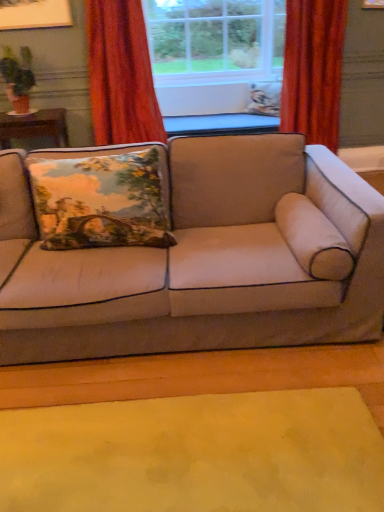
What is the approximate width of floral fabric pillow at center, which appears as the 2th pillow when viewed from the left?

It is 8.30 inches.

Image resolution: width=384 pixels, height=512 pixels. What do you see at coordinates (264, 98) in the screenshot?
I see `floral fabric pillow at center, marked as the 1th pillow in a right-to-left arrangement` at bounding box center [264, 98].

The height and width of the screenshot is (512, 384). Describe the element at coordinates (196, 454) in the screenshot. I see `yellow felt mat at lower center` at that location.

Consider the image. What is the approximate width of clear glass window at center?

32.29 inches.

The height and width of the screenshot is (512, 384). What do you see at coordinates (121, 74) in the screenshot?
I see `velvet orange curtain at upper left, the 1th curtain viewed from the left` at bounding box center [121, 74].

Measure the distance between point (331, 104) and camera.

Point (331, 104) is 3.58 meters away from camera.

I want to click on beige fabric couch at center, so click(204, 260).

Describe the element at coordinates (204, 260) in the screenshot. This screenshot has width=384, height=512. I see `beige fabric couch at center` at that location.

Find the location of `floral fabric pillow at center, which appears as the 1th pillow when viewed from the top`. floral fabric pillow at center, which appears as the 1th pillow when viewed from the top is located at coordinates (264, 98).

Considering the positions of objects velvet orange curtain at upper left, the second curtain when ordered from right to left, and clear glass window at center in the image provided, who is more to the left, velvet orange curtain at upper left, the second curtain when ordered from right to left, or clear glass window at center?

velvet orange curtain at upper left, the second curtain when ordered from right to left.

Considering the positions of points (140, 91) and (250, 60), is point (140, 91) farther from camera compared to point (250, 60)?

No, (140, 91) is closer to viewer.

Is the surface of velvet orange curtain at upper left, the second curtain when ordered from right to left, in direct contact with clear glass window at center?

No, velvet orange curtain at upper left, the second curtain when ordered from right to left, is not making contact with clear glass window at center.

Considering the positions of point (31, 57) and point (262, 224), is point (31, 57) closer or farther from the camera than point (262, 224)?

Point (31, 57) is farther from the camera than point (262, 224).

How different are the orientations of matte brown pot at left and beige fabric couch at center in degrees?

matte brown pot at left and beige fabric couch at center are facing 1.25 degrees away from each other.

Is matte brown pot at left oriented towards beige fabric couch at center?

No.

Looking at this image, from the image's perspective, relative to beige fabric couch at center, is matte brown pot at left above or below?

matte brown pot at left is situated higher than beige fabric couch at center in the image.

Is velvet-like red curtain at right, acting as the first curtain starting from the right, oriented towards beige fabric couch at center?

No, velvet-like red curtain at right, acting as the first curtain starting from the right, does not turn towards beige fabric couch at center.

Based on their sizes in the image, would you say velvet-like red curtain at right, acting as the first curtain starting from the right, is bigger or smaller than beige fabric couch at center?

In the image, velvet-like red curtain at right, acting as the first curtain starting from the right, appears to be smaller than beige fabric couch at center.

Are velvet-like red curtain at right, positioned as the second curtain in left-to-right order, and beige fabric couch at center beside each other?

There is a gap between velvet-like red curtain at right, positioned as the second curtain in left-to-right order, and beige fabric couch at center.

From a real-world perspective, does velvet orange curtain at upper left, the second curtain when ordered from right to left, sit lower than matte brown pot at left?

Yes, from a real-world perspective, velvet orange curtain at upper left, the second curtain when ordered from right to left, is beneath matte brown pot at left.

Is velvet orange curtain at upper left, the second curtain when ordered from right to left, far from matte brown pot at left?

velvet orange curtain at upper left, the second curtain when ordered from right to left, is near matte brown pot at left, not far away.

Is velvet orange curtain at upper left, the second curtain when ordered from right to left, bigger than matte brown pot at left?

Yes, velvet orange curtain at upper left, the second curtain when ordered from right to left, is bigger than matte brown pot at left.

Between point (137, 22) and point (19, 92), which one is positioned behind?

Point (19, 92)

Based on the photo, measure the distance from yellow felt mat at lower center to matte brown pot at left.

They are 2.87 meters apart.

Which of these two, yellow felt mat at lower center or matte brown pot at left, stands shorter?

Standing shorter between the two is yellow felt mat at lower center.

From the image's perspective, is yellow felt mat at lower center beneath matte brown pot at left?

Yes, from the image's perspective, yellow felt mat at lower center is below matte brown pot at left.

Is yellow felt mat at lower center to the right of matte brown pot at left from the viewer's perspective?

Indeed, yellow felt mat at lower center is positioned on the right side of matte brown pot at left.

From the picture: Measure the distance between yellow felt mat at lower center and clear glass window at center.

The distance of yellow felt mat at lower center from clear glass window at center is 14.08 feet.

Is yellow felt mat at lower center shorter than clear glass window at center?

Yes.

Considering the positions of objects yellow felt mat at lower center and clear glass window at center in the image provided, who is more to the right, yellow felt mat at lower center or clear glass window at center?

Positioned to the right is clear glass window at center.

From a real-world perspective, does floral fabric pillow at center, which is counted as the second pillow, starting from the front, sit lower than velvet-like red curtain at right, positioned as the second curtain in left-to-right order?

Yes, from a real-world perspective, floral fabric pillow at center, which is counted as the second pillow, starting from the front, is below velvet-like red curtain at right, positioned as the second curtain in left-to-right order.

From the image's perspective, is floral fabric pillow at center, which appears as the 1th pillow when viewed from the top, located above or below velvet-like red curtain at right, positioned as the second curtain in left-to-right order?

floral fabric pillow at center, which appears as the 1th pillow when viewed from the top, is above velvet-like red curtain at right, positioned as the second curtain in left-to-right order.

Considering the positions of point (250, 98) and point (296, 34), is point (250, 98) closer or farther from the camera than point (296, 34)?

Point (250, 98).

Identify the location of pillow that appears above the velvet-like red curtain at right, positioned as the second curtain in left-to-right order (from the image's perspective). (264, 98).

This screenshot has height=512, width=384. Identify the location of the 1st curtain positioned below the clear glass window at center (from a real-world perspective). (121, 74).

Identify the location of studio couch on the right of matte brown pot at left. (204, 260).

When comparing their distances from velvet floral pillow at left, the 2th pillow from the back, does clear glass window at center or velvet orange curtain at upper left, the 1th curtain viewed from the left, seem further?

Based on the image, clear glass window at center appears to be further to velvet floral pillow at left, the 2th pillow from the back.

Considering their positions, is velvet floral pillow at left, which is the first pillow in bottom-to-top order, positioned further to velvet orange curtain at upper left, the 1th curtain viewed from the left, than beige fabric couch at center?

beige fabric couch at center lies further to velvet orange curtain at upper left, the 1th curtain viewed from the left, than the other object.

When comparing their distances from matte brown pot at left, does beige fabric couch at center or floral fabric pillow at center, placed as the 2th pillow when sorted from bottom to top, seem further?

The object further to matte brown pot at left is beige fabric couch at center.

Which object lies nearer to the anchor point floral fabric pillow at center, which is counted as the second pillow, starting from the front, beige fabric couch at center or velvet-like red curtain at right, acting as the first curtain starting from the right?

Among the two, velvet-like red curtain at right, acting as the first curtain starting from the right, is located nearer to floral fabric pillow at center, which is counted as the second pillow, starting from the front.

In the scene shown: Looking at the image, which one is located closer to matte brown pot at left, beige fabric couch at center or velvet orange curtain at upper left, the second curtain when ordered from right to left?

Based on the image, velvet orange curtain at upper left, the second curtain when ordered from right to left, appears to be nearer to matte brown pot at left.

Based on their spatial positions, is clear glass window at center or floral fabric pillow at center, marked as the 1th pillow in a right-to-left arrangement, further from yellow felt mat at lower center?

clear glass window at center.

From the picture: Which object lies further to the anchor point beige fabric couch at center, clear glass window at center or floral fabric pillow at center, which appears as the 2th pillow when viewed from the left?

clear glass window at center is further to beige fabric couch at center.

From the image, which object appears to be nearer to beige fabric couch at center, floral fabric pillow at center, which appears as the 1th pillow when viewed from the top, or velvet orange curtain at upper left, the 1th curtain viewed from the left?

velvet orange curtain at upper left, the 1th curtain viewed from the left, is closer to beige fabric couch at center.

You are a GUI agent. You are given a task and a screenshot of the screen. Output one action in this format:
    pyautogui.click(x=<x>, y=<y>)
    Task: Click on the plant between clear glass window at center and yellow felt mat at lower center vertically
    
    Given the screenshot: What is the action you would take?
    coord(18,70)

At what (x,y) coordinates should I click in order to perform the action: click on studio couch between clear glass window at center and yellow felt mat at lower center in the vertical direction. Please return your answer as a coordinate pair (x, y). Looking at the image, I should click on (204, 260).

I want to click on window between beige fabric couch at center and floral fabric pillow at center, marked as the 1th pillow in a right-to-left arrangement, along the z-axis, so click(215, 38).

Locate an element on the screen. This screenshot has height=512, width=384. studio couch between velvet floral pillow at left, the 2th pillow from the back, and velvet-like red curtain at right, acting as the first curtain starting from the right, in the horizontal direction is located at coordinates (204, 260).